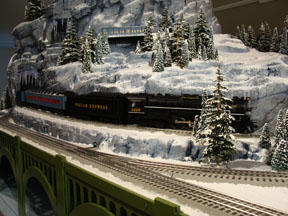
Image resolution: width=288 pixels, height=216 pixels. In order to click on window in this screenshot , I will do click(x=115, y=31), click(x=130, y=30), click(x=137, y=29).